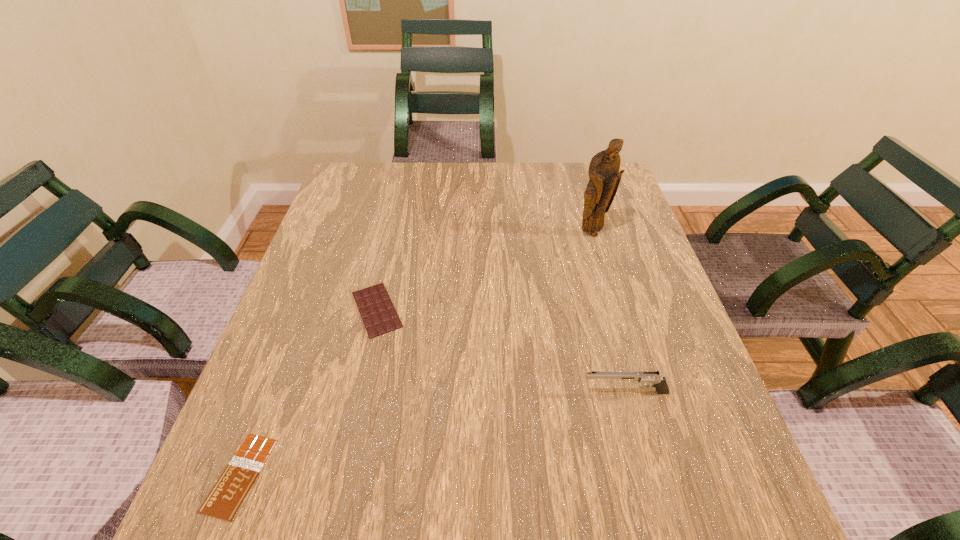
You are a GUI agent. You are given a task and a screenshot of the screen. Output one action in this format:
    pyautogui.click(x=<x>, y=<y>)
    Task: Click on the vacant point located between the right chocolate bar and the nearer chocolate bar
    This screenshot has width=960, height=540.
    Given the screenshot: What is the action you would take?
    pyautogui.click(x=309, y=392)

Image resolution: width=960 pixels, height=540 pixels. I want to click on free space between the shortest object and the farthest object, so click(x=416, y=354).

At what (x,y) coordinates should I click in order to perform the action: click on free space that is in between the second nearest object and the third tallest object. Please return your answer as a coordinate pair (x, y). Looking at the image, I should click on (501, 351).

Locate an element on the screen. blank region between the farther chocolate bar and the figurine is located at coordinates (484, 272).

Identify the location of object that is the closest to the pistol. The height and width of the screenshot is (540, 960). (377, 311).

You are a GUI agent. You are given a task and a screenshot of the screen. Output one action in this format:
    pyautogui.click(x=<x>, y=<y>)
    Task: Click on the second closest object to the third farthest object
    This screenshot has height=540, width=960.
    Given the screenshot: What is the action you would take?
    pyautogui.click(x=604, y=174)

Identify the location of vacant space that satisfies the following two spatial constraints: 1. on the front-facing side of the figurine; 2. on the front-facing side of the pistol. Image resolution: width=960 pixels, height=540 pixels. (637, 393).

The image size is (960, 540). Identify the location of vacant region that satisfies the following two spatial constraints: 1. on the front-facing side of the figurine; 2. on the front-facing side of the second nearest object. (x=637, y=393).

Locate an element on the screen. vacant space that satisfies the following two spatial constraints: 1. on the back side of the leftmost object; 2. on the right side of the taller chocolate bar is located at coordinates (303, 309).

Find the location of a particular element. free spot that satisfies the following two spatial constraints: 1. on the back side of the farther chocolate bar; 2. on the left side of the nearest object is located at coordinates (303, 309).